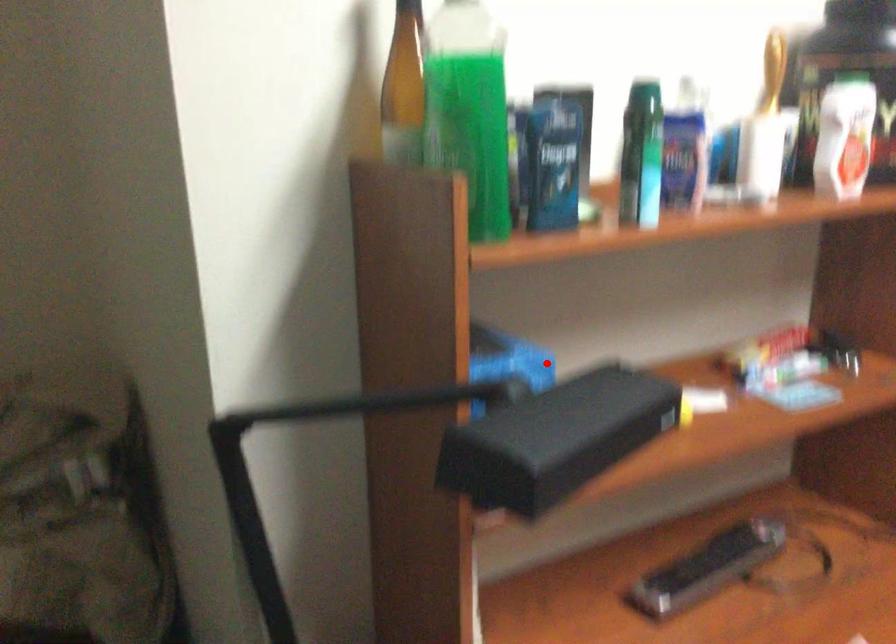
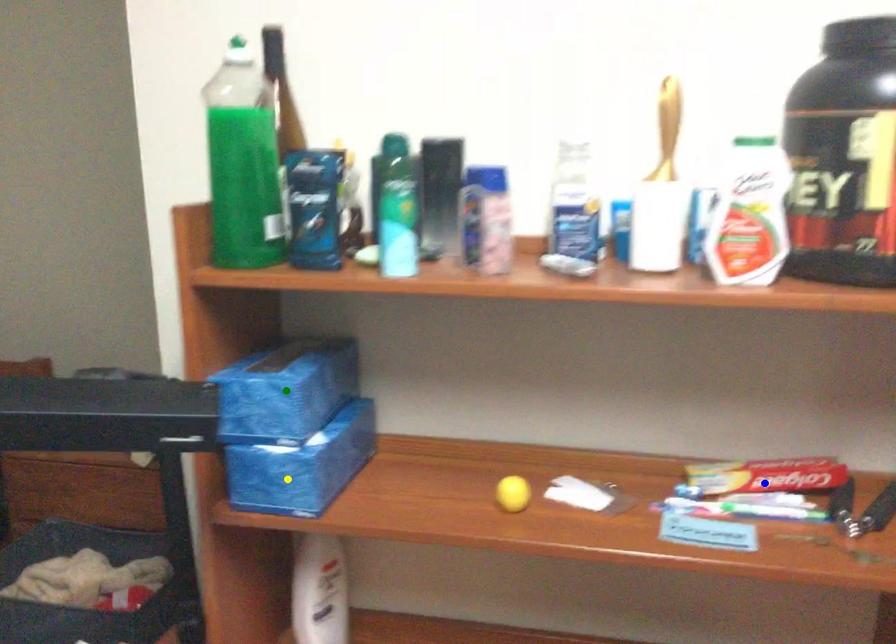
Question: I am providing you with two images of the same scene from different viewpoints. A red point is marked on the first image. You are given multiple points on the second image. Which mark in image 2 goes with the point in image 1?

Choices:
 (A) green point
 (B) yellow point
 (C) blue point

Answer: (A)